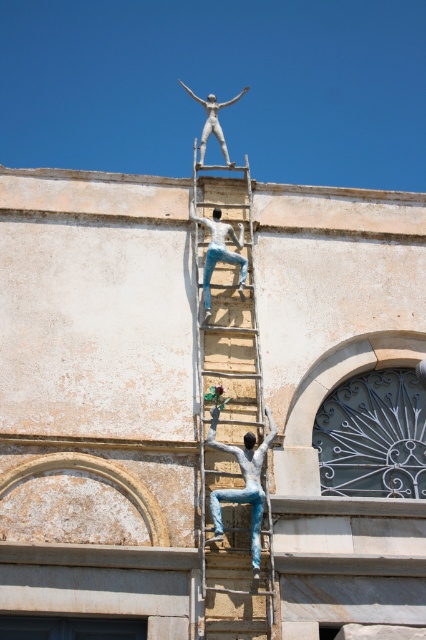
Can you confirm if denim jeans at center is wider than white glossy statue at center?

Correct, the width of denim jeans at center exceeds that of white glossy statue at center.

Consider the image. Is denim jeans at center to the right of white glossy statue at center from the viewer's perspective?

Yes, denim jeans at center is to the right of white glossy statue at center.

Which is behind, point (247, 490) or point (206, 320)?

The point (206, 320) is behind.

Identify the location of denim jeans at center. This screenshot has height=640, width=426. (244, 486).

Which is more to the right, wooden ladder at upper center or silver metallic statue at upper center?

From the viewer's perspective, silver metallic statue at upper center appears more on the right side.

Is wooden ladder at upper center smaller than silver metallic statue at upper center?

Correct, wooden ladder at upper center occupies less space than silver metallic statue at upper center.

Locate an element on the screen. wooden ladder at upper center is located at coordinates (230, 417).

Does wooden ladder at upper center have a greater height compared to white glossy statue at center?

Yes, wooden ladder at upper center is taller than white glossy statue at center.

Between wooden ladder at upper center and white glossy statue at center, which one appears on the right side from the viewer's perspective?

Positioned to the right is wooden ladder at upper center.

At what (x,y) coordinates should I click in order to perform the action: click on wooden ladder at upper center. Please return your answer as a coordinate pair (x, y). The height and width of the screenshot is (640, 426). Looking at the image, I should click on (x=230, y=417).